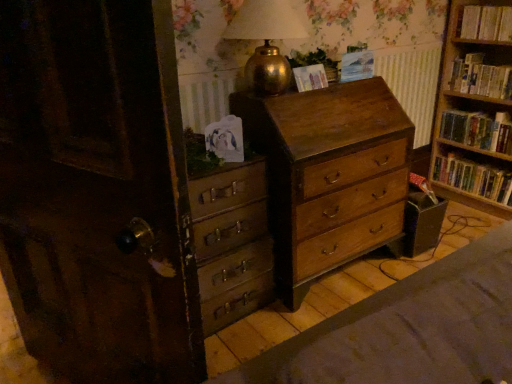
Question: From the image's perspective, would you say matte paper at upper center, which is the first paperback book from left to right, is shown under hardcover books at right, placed as the 3th book when sorted from bottom to top?

Choices:
 (A) no
 (B) yes

Answer: (B)

Question: Is matte paper at upper center, which is counted as the 2th paperback book, starting from the right, oriented towards hardcover books at right, placed as the 3th book when sorted from bottom to top?

Choices:
 (A) yes
 (B) no

Answer: (B)

Question: Is matte paper at upper center, which is counted as the 2th paperback book, starting from the right, placed right next to hardcover books at right, placed as the 3th book when sorted from bottom to top?

Choices:
 (A) yes
 (B) no

Answer: (B)

Question: Is matte paper at upper center, which is the first paperback book from left to right, oriented away from hardcover books at right, placed as the 3th book when sorted from bottom to top?

Choices:
 (A) yes
 (B) no

Answer: (B)

Question: Is matte paper at upper center, which is the first paperback book from left to right, smaller than hardcover books at right, the second book when ordered from top to bottom?

Choices:
 (A) no
 (B) yes

Answer: (B)

Question: Relative to hardcover book at right, placed as the third book when sorted from top to bottom, is gold metallic table lamp at upper center in front or behind?

Choices:
 (A) behind
 (B) front

Answer: (B)

Question: From the image's perspective, relative to hardcover book at right, positioned as the 2th book in bottom-to-top order, is gold metallic table lamp at upper center above or below?

Choices:
 (A) above
 (B) below

Answer: (A)

Question: Looking at their shapes, would you say gold metallic table lamp at upper center is wider or thinner than hardcover book at right, placed as the third book when sorted from top to bottom?

Choices:
 (A) wide
 (B) thin

Answer: (A)

Question: Is gold metallic table lamp at upper center bigger or smaller than hardcover book at right, positioned as the 2th book in bottom-to-top order?

Choices:
 (A) big
 (B) small

Answer: (A)

Question: Would you say wooden chest of drawers at center, the 2th chest of drawers positioned from the left, is inside or outside blue paper at upper center, which is counted as the 1th paperback book, starting from the right?

Choices:
 (A) outside
 (B) inside

Answer: (A)

Question: From the image's perspective, is wooden chest of drawers at center, which is the 1th chest of drawers in right-to-left order, located above or below blue paper at upper center, which is counted as the 1th paperback book, starting from the right?

Choices:
 (A) above
 (B) below

Answer: (B)

Question: From a real-world perspective, relative to blue paper at upper center, which is the second paperback book in left-to-right order, is wooden chest of drawers at center, the 2th chest of drawers positioned from the left, vertically above or below?

Choices:
 (A) below
 (B) above

Answer: (A)

Question: Considering the positions of wooden chest of drawers at center, the 2th chest of drawers positioned from the left, and blue paper at upper center, which is counted as the 1th paperback book, starting from the right, in the image, is wooden chest of drawers at center, the 2th chest of drawers positioned from the left, taller or shorter than blue paper at upper center, which is counted as the 1th paperback book, starting from the right,?

Choices:
 (A) tall
 (B) short

Answer: (A)

Question: In terms of size, does hardcover books at upper right, acting as the 1th book starting from the top, appear bigger or smaller than hardcover book at right, positioned as the 2th book in bottom-to-top order?

Choices:
 (A) small
 (B) big

Answer: (A)

Question: From their relative heights in the image, would you say hardcover books at upper right, acting as the 1th book starting from the top, is taller or shorter than hardcover book at right, placed as the third book when sorted from top to bottom?

Choices:
 (A) short
 (B) tall

Answer: (A)